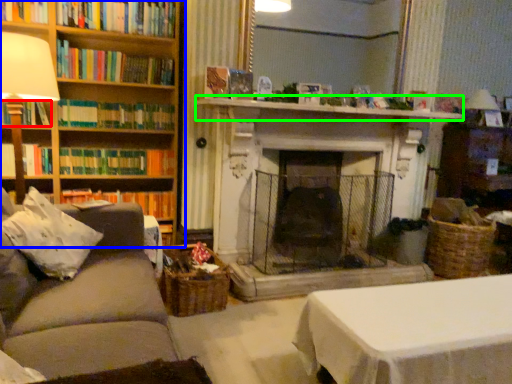
Question: Which object is the closest to the book (highlighted by a red box)? Choose among these: bookcase (highlighted by a blue box) or mantle (highlighted by a green box).

Choices:
 (A) bookcase
 (B) mantle

Answer: (A)